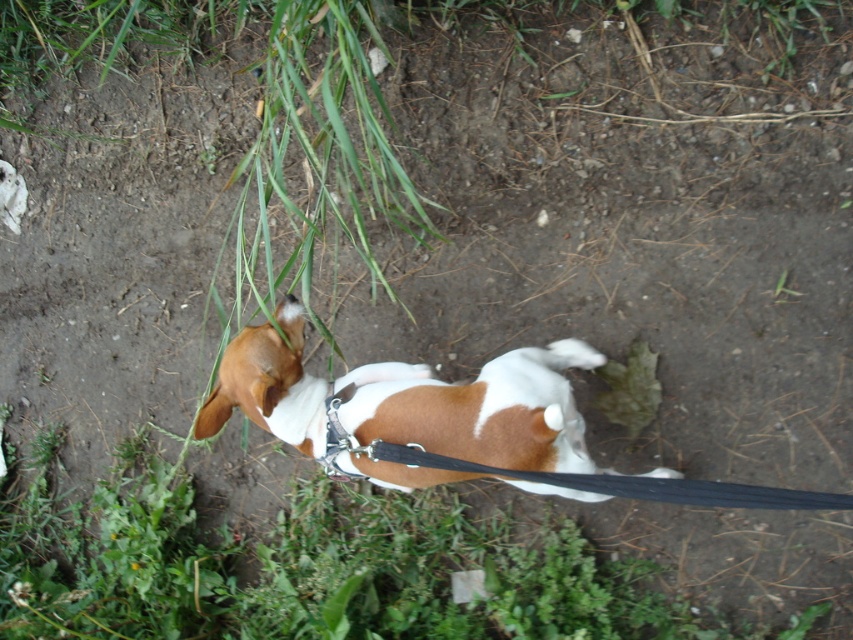
Question: Among these points, which one is farthest from the camera?

Choices:
 (A) (512, 392)
 (B) (654, 385)
 (C) (328, 451)

Answer: (B)

Question: Based on their relative distances, which object is nearer to the green leafy patch at lower center?

Choices:
 (A) brown and white fur at center
 (B) metallic silver collar at center

Answer: (A)

Question: Can you confirm if brown and white fur at center is bigger than green leafy patch at lower center?

Choices:
 (A) yes
 (B) no

Answer: (A)

Question: Which of the following is the closest to the observer?

Choices:
 (A) green leafy patch at lower center
 (B) brown and white fur at center

Answer: (B)

Question: Is brown and white fur at center closer to camera compared to green leafy patch at lower center?

Choices:
 (A) yes
 (B) no

Answer: (A)

Question: Is brown and white fur at center below green leafy patch at lower center?

Choices:
 (A) no
 (B) yes

Answer: (A)